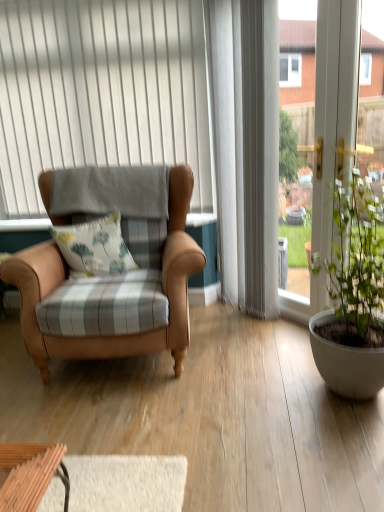
Find the location of `free location in front of leather armchair at left`. free location in front of leather armchair at left is located at coordinates (155, 437).